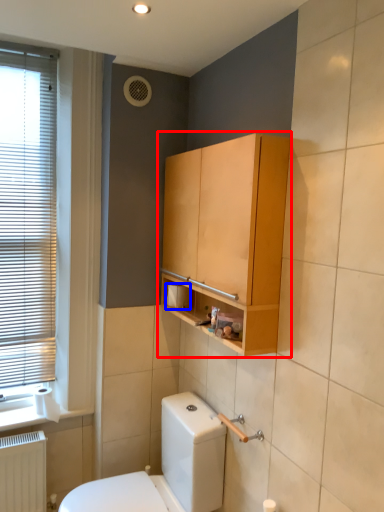
Question: Which object appears farthest to the camera in this image, bathroom cabinet (highlighted by a red box) or toilet paper (highlighted by a blue box)?

Choices:
 (A) bathroom cabinet
 (B) toilet paper

Answer: (B)